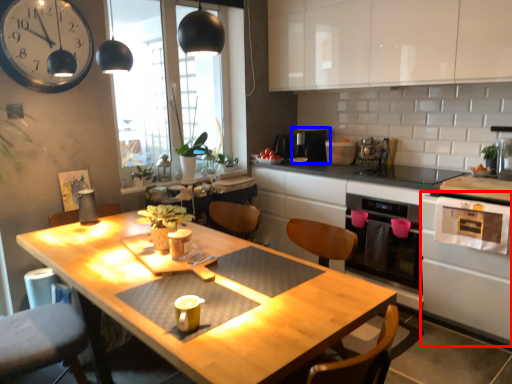
Question: Which point is further to the camera, oven (highlighted by a red box) or appliance (highlighted by a blue box)?

Choices:
 (A) oven
 (B) appliance

Answer: (B)